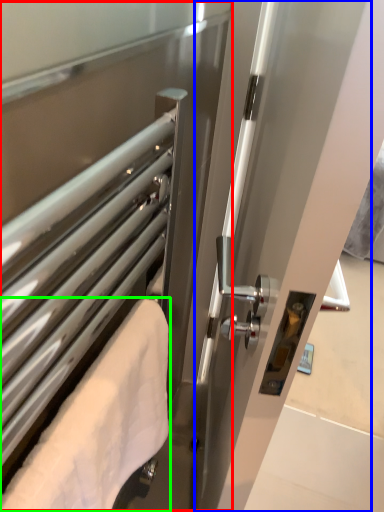
Question: Estimate the real-world distances between objects in this image. Which object is farther from screen door (highlighted by a red box), screen door (highlighted by a blue box) or towel (highlighted by a green box)?

Choices:
 (A) screen door
 (B) towel

Answer: (A)